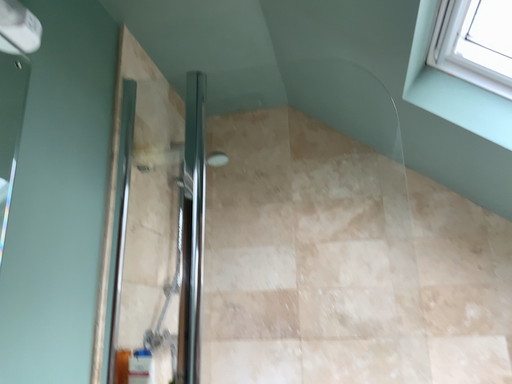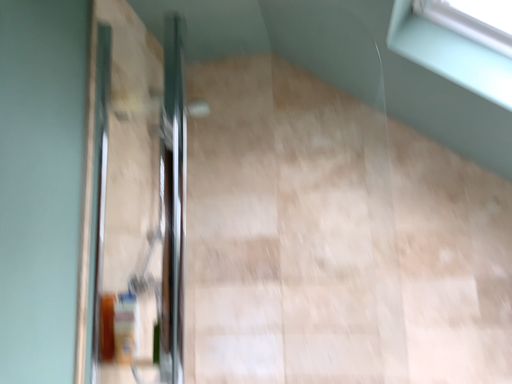
Question: How did the camera likely rotate when shooting the video?

Choices:
 (A) rotated downward
 (B) rotated upward

Answer: (A)